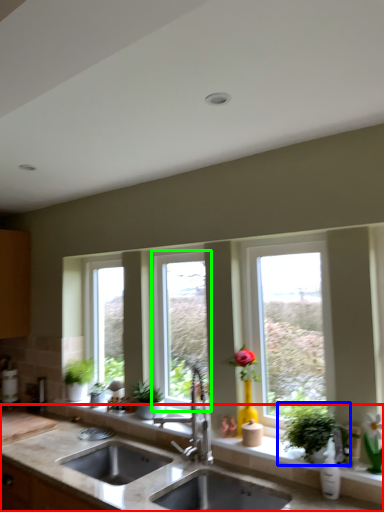
Question: Considering the real-world distances, which object is farthest from countertop (highlighted by a red box)? houseplant (highlighted by a blue box) or window (highlighted by a green box)?

Choices:
 (A) houseplant
 (B) window

Answer: (B)